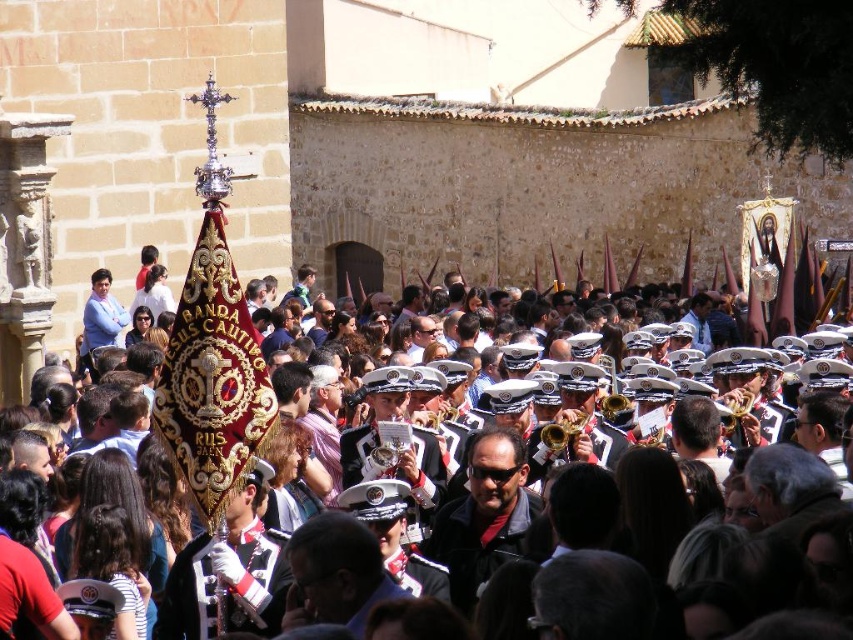
You are a photographer standing in the courtyard and want to take a photo of both the velvet red banner at center and the gold brass trumpet at center. The minimum distance required for your camera to focus on both objects clearly is 5 meters. Can you capture both in focus without moving your position?

The velvet red banner at center is 7.48 meters from the gold brass trumpet at center. Since the distance between them is greater than the 5 meter minimum focus requirement, you can capture both in focus without moving your position.

Looking at this image, you are standing in the courtyard and want to take a photo of the point at coordinates (604, 465). If your camera has a focal length of 50mm and you are 63.90 meters away from that point, what is the angle of view required to capture the point in the center of your photo?

The angle of view required to capture the point at coordinates (604, 465) can be calculated using the formula for angle of view, which is 2 arctan. However, since the distance to the point is 63.90 meters and the focal length is 50mm, the angle of view needed would be approximately 2 times the arctangent of the sensor size divided by twice the focal length. But without knowing the sensor size, we can state that the camera must be positioned such that the point is centered within the frame, considering the

You are standing at the center of the courtyard and see two points marked in the image. The first point is at coordinate point(788, 308) and the second is at point(564, 445). Which point is closer to you?

Point(564, 445) is closer to you because it is in front of point(788, 308).